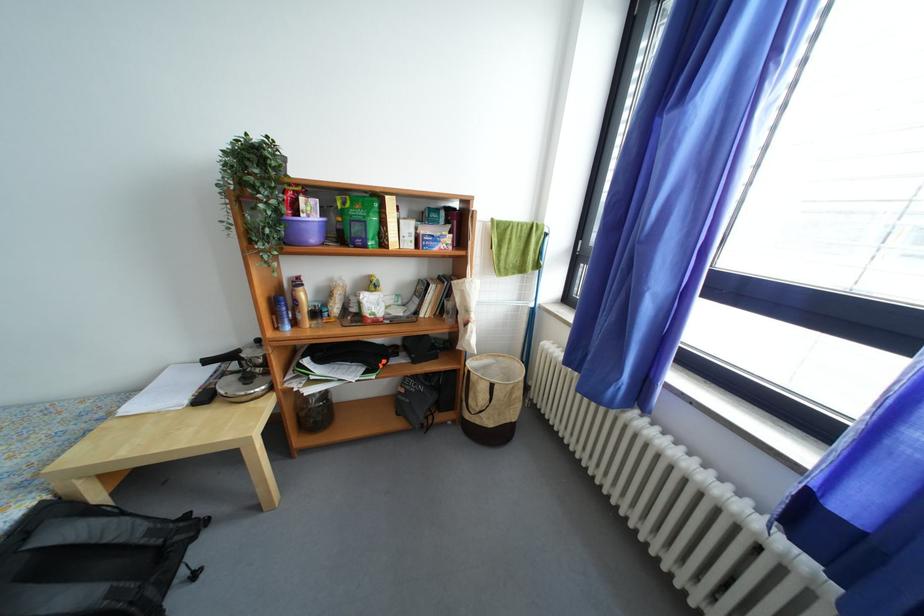
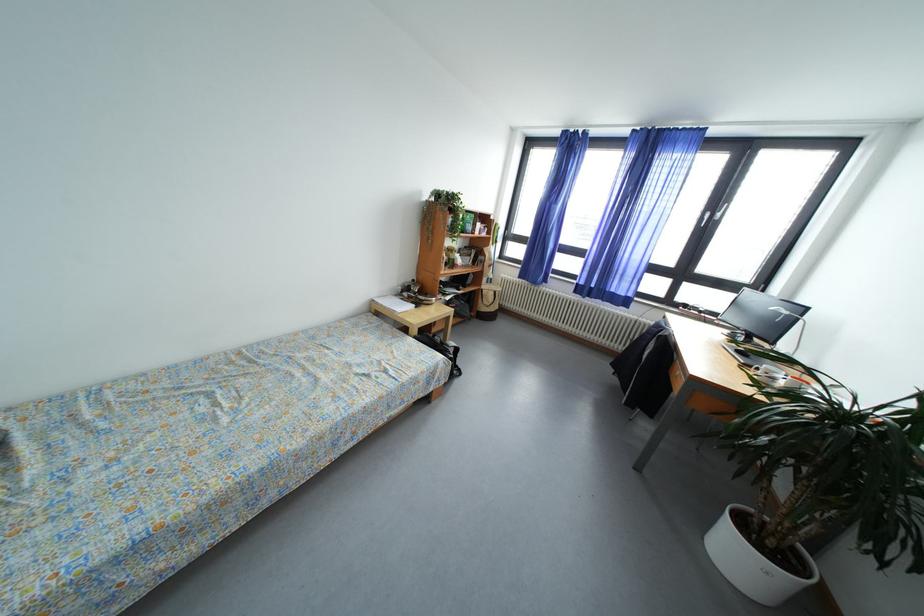
In the second image, find the point that corresponds to the point at 499,391 in the first image.

(502, 297)